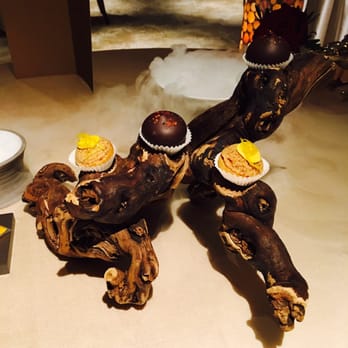
The height and width of the screenshot is (348, 348). Find the location of `plate`. plate is located at coordinates (8, 150).